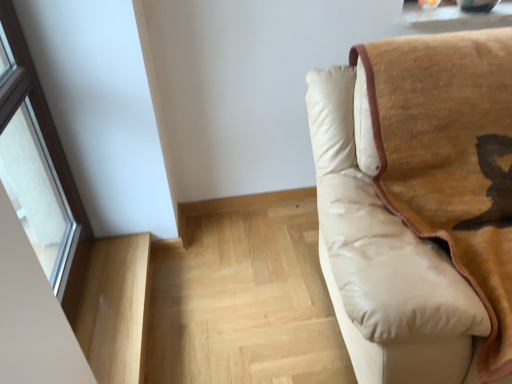
Question: In the image, is beige leather couch at right positioned in front of or behind light wood stairwell at lower left, which ranks as the 2th stairwell in left-to-right order?

Choices:
 (A) front
 (B) behind

Answer: (A)

Question: From a real-world perspective, is beige leather couch at right above or below light wood stairwell at lower left, the 1th stairwell positioned from the right?

Choices:
 (A) above
 (B) below

Answer: (A)

Question: Estimate the real-world distances between objects in this image. Which object is closer to the beige leather couch at right?

Choices:
 (A) light wood stairwell at lower left, the 2th stairwell viewed from the right
 (B) light wood stairwell at lower left, which ranks as the 2th stairwell in left-to-right order
 (C) transparent glass window at left

Answer: (B)

Question: Estimate the real-world distances between objects in this image. Which object is farther from the light wood stairwell at lower left, acting as the first stairwell starting from the left?

Choices:
 (A) light wood stairwell at lower left, which ranks as the 2th stairwell in left-to-right order
 (B) beige leather couch at right
 (C) transparent glass window at left

Answer: (B)